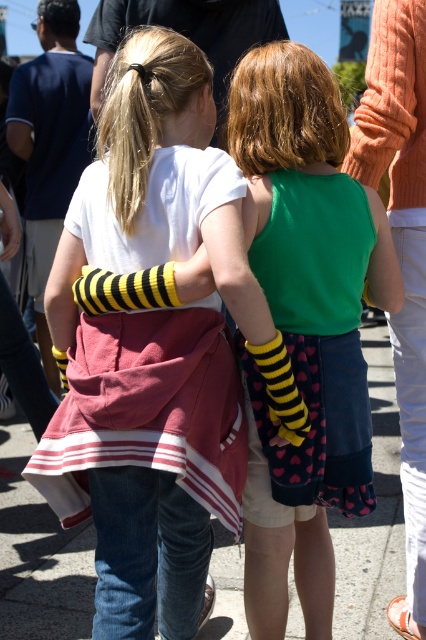
Between white cotton shirt at center and green fabric dress at center, which one has more height?

Standing taller between the two is white cotton shirt at center.

Does point (166, 36) lie behind point (281, 257)?

No, it is not.

The image size is (426, 640). Describe the element at coordinates (158, 346) in the screenshot. I see `white cotton shirt at center` at that location.

Locate an element on the screen. white cotton shirt at center is located at coordinates (158, 346).